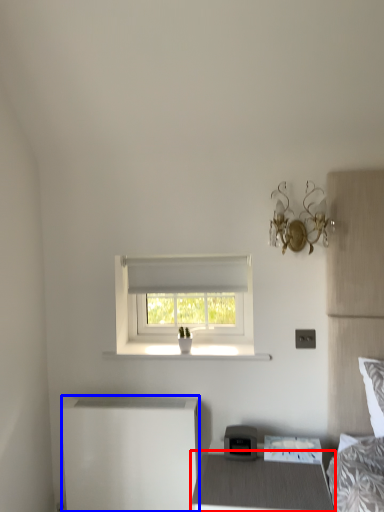
Question: Among these objects, which one is nearest to the camera, nightstand (highlighted by a red box) or changing table (highlighted by a blue box)?

Choices:
 (A) nightstand
 (B) changing table

Answer: (A)